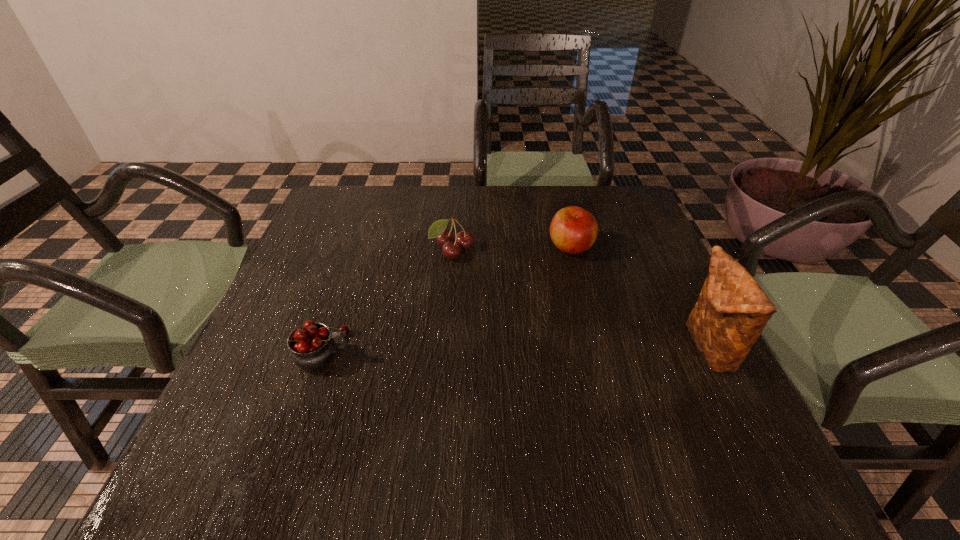
In order to click on vacant area that lies between the second object from right to left and the clutch bag in this screenshot , I will do `click(639, 298)`.

At what (x,y) coordinates should I click in order to perform the action: click on vacant point located between the apple and the tallest object. Please return your answer as a coordinate pair (x, y). This screenshot has height=540, width=960. Looking at the image, I should click on (639, 298).

This screenshot has width=960, height=540. In order to click on unoccupied area between the tallest object and the nearer cherry in this screenshot , I will do `click(516, 349)`.

Identify the location of free space between the second object from right to left and the rightmost object. (639, 298).

Find the location of a particular element. The image size is (960, 540). vacant area that lies between the tallest object and the right cherry is located at coordinates (580, 300).

Find the location of a particular element. free space that is in between the nearer cherry and the apple is located at coordinates (448, 299).

Choose which object is the nearest neighbor to the third object from left to right. Please provide its 2D coordinates. Your answer should be formatted as a tuple, i.e. [(x, y)], where the tuple contains the x and y coordinates of a point satisfying the conditions above.

[(463, 240)]

Point out which object is positioned as the third nearest to the leftmost object. Please provide its 2D coordinates. Your answer should be formatted as a tuple, i.e. [(x, y)], where the tuple contains the x and y coordinates of a point satisfying the conditions above.

[(732, 310)]

This screenshot has height=540, width=960. In order to click on free point that satisfies the following two spatial constraints: 1. on the front side of the apple; 2. on the open side of the rightmost object in this screenshot , I will do `click(596, 348)`.

I want to click on free space that satisfies the following two spatial constraints: 1. on the front side of the clutch bag; 2. on the open side of the apple, so click(596, 348).